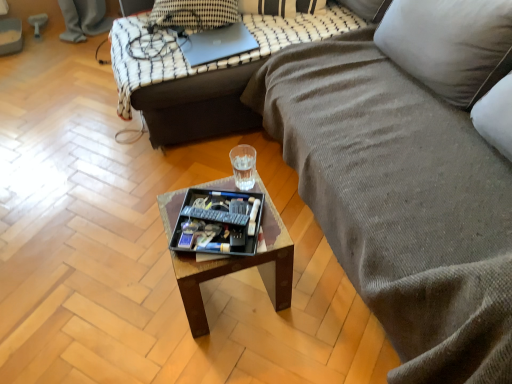
Identify the location of free space in front of wooden tray at center. (232, 355).